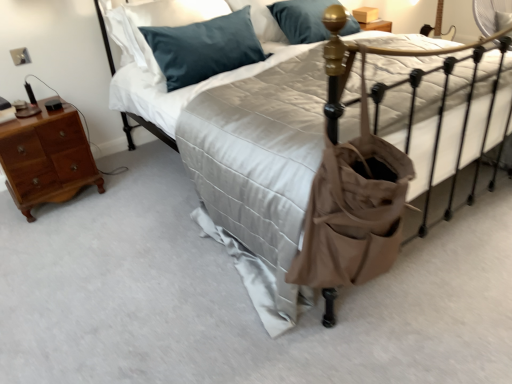
Question: Is teal fabric pillow at upper left, the second pillow viewed from the front, smaller than matte brown tote at center?

Choices:
 (A) no
 (B) yes

Answer: (A)

Question: Does teal fabric pillow at upper left, the second pillow viewed from the front, have a larger size compared to matte brown tote at center?

Choices:
 (A) yes
 (B) no

Answer: (A)

Question: Is teal fabric pillow at upper left, the second pillow viewed from the front, to the left of matte brown tote at center from the viewer's perspective?

Choices:
 (A) yes
 (B) no

Answer: (A)

Question: Does teal fabric pillow at upper left, placed as the 1th pillow when sorted from back to front, have a lesser height compared to matte brown tote at center?

Choices:
 (A) no
 (B) yes

Answer: (B)

Question: Can matte brown tote at center be found inside teal fabric pillow at upper left, placed as the 1th pillow when sorted from back to front?

Choices:
 (A) no
 (B) yes

Answer: (A)

Question: Considering their positions, is teal fabric pillow at upper left, placed as the 1th pillow when sorted from back to front, located in front of or behind light brown wood nightstand at left?

Choices:
 (A) front
 (B) behind

Answer: (B)

Question: Based on their positions, is teal fabric pillow at upper left, placed as the 1th pillow when sorted from back to front, located to the left or right of light brown wood nightstand at left?

Choices:
 (A) left
 (B) right

Answer: (B)

Question: Would you say teal fabric pillow at upper left, the second pillow viewed from the front, is inside or outside light brown wood nightstand at left?

Choices:
 (A) inside
 (B) outside

Answer: (B)

Question: From the image's perspective, is teal fabric pillow at upper left, the second pillow viewed from the front, positioned above or below light brown wood nightstand at left?

Choices:
 (A) above
 (B) below

Answer: (A)

Question: Looking at their shapes, would you say matte beige bed at center is wider or thinner than teal fabric pillow at upper left, the second pillow viewed from the front?

Choices:
 (A) wide
 (B) thin

Answer: (A)

Question: Based on their sizes in the image, would you say matte beige bed at center is bigger or smaller than teal fabric pillow at upper left, placed as the 1th pillow when sorted from back to front?

Choices:
 (A) small
 (B) big

Answer: (B)

Question: Relative to teal fabric pillow at upper left, the second pillow viewed from the front, is matte beige bed at center in front or behind?

Choices:
 (A) behind
 (B) front

Answer: (B)

Question: Is point (133, 64) positioned closer to the camera than point (214, 6)?

Choices:
 (A) farther
 (B) closer

Answer: (A)

Question: From the image's perspective, relative to light brown wood nightstand at left, is satin blue pillow at upper center, arranged as the first pillow when viewed from the front, above or below?

Choices:
 (A) below
 (B) above

Answer: (B)

Question: Based on their sizes in the image, would you say satin blue pillow at upper center, placed as the second pillow when sorted from back to front, is bigger or smaller than light brown wood nightstand at left?

Choices:
 (A) big
 (B) small

Answer: (A)